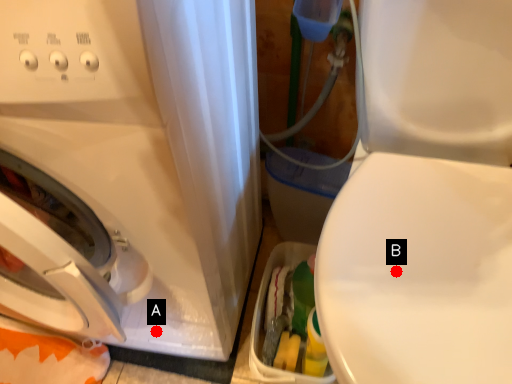
Question: Two points are circled on the image, labeled by A and B beside each circle. Which of the following is the farthest from the observer?

Choices:
 (A) A is further
 (B) B is further

Answer: (A)